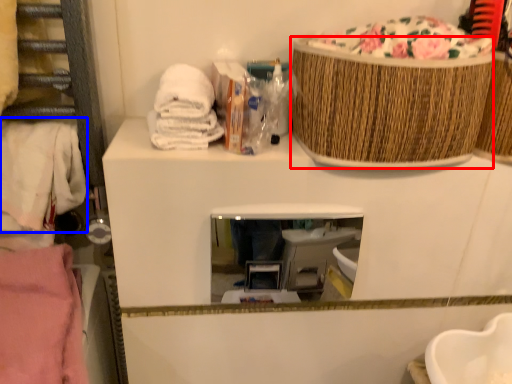
Question: Which point is further to the camera, basket (highlighted by a red box) or clothing (highlighted by a blue box)?

Choices:
 (A) basket
 (B) clothing

Answer: (B)